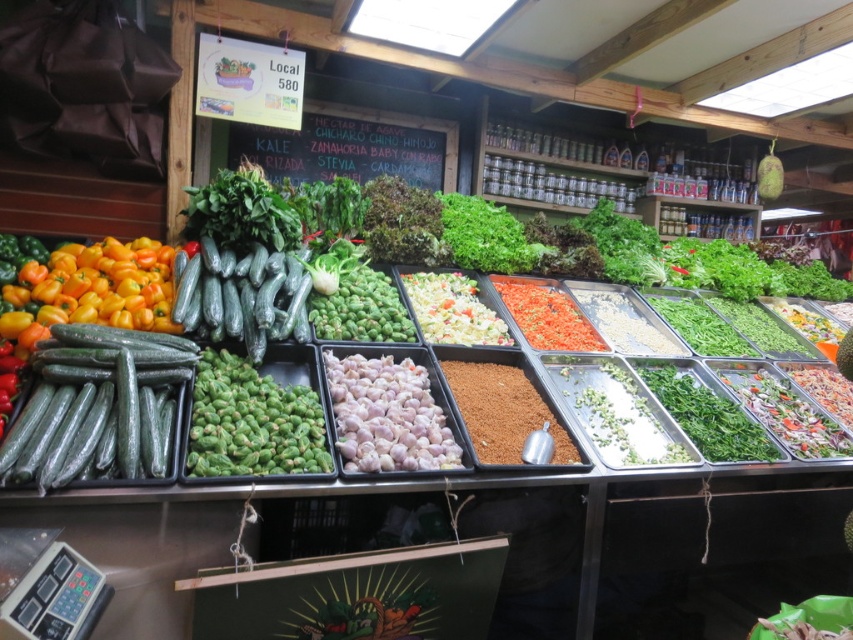
Who is higher up, black chalkboard at upper center or bright red dried chili flakes at center?

black chalkboard at upper center is higher up.

Is black chalkboard at upper center smaller than bright red dried chili flakes at center?

No.

Which is in front, point (331, 140) or point (502, 298)?

Positioned in front is point (502, 298).

Where is `black chalkboard at upper center`? This screenshot has width=853, height=640. black chalkboard at upper center is located at coordinates 351,147.

Is white crumbly at center smaller than bright red dried chili flakes at center?

Correct, white crumbly at center occupies less space than bright red dried chili flakes at center.

Is white crumbly at center shorter than bright red dried chili flakes at center?

Incorrect, white crumbly at center's height does not fall short of bright red dried chili flakes at center's.

This screenshot has width=853, height=640. I want to click on white crumbly at center, so [451, 310].

Find the location of a particular element. Image resolution: width=853 pixels, height=640 pixels. white crumbly at center is located at coordinates (451, 310).

Can you confirm if white matte garlic at center is positioned below white crumbly at center?

Yes, white matte garlic at center is below white crumbly at center.

The width and height of the screenshot is (853, 640). Describe the element at coordinates (387, 416) in the screenshot. I see `white matte garlic at center` at that location.

Image resolution: width=853 pixels, height=640 pixels. Identify the location of white matte garlic at center. (387, 416).